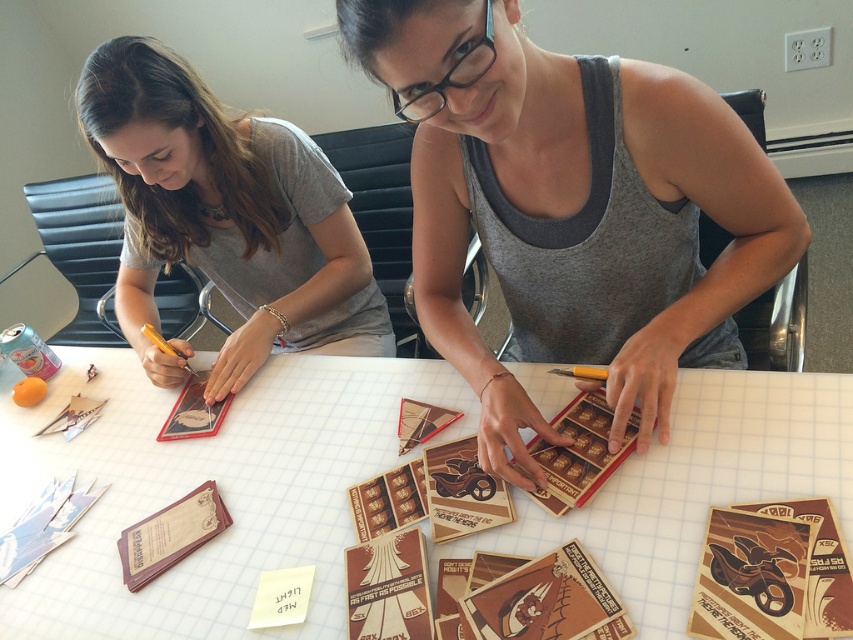
Question: Considering the real-world distances, which object is closest to the matte gray shirt at upper left?

Choices:
 (A) gray tank top at center
 (B) white grid paper at center

Answer: (B)

Question: Which object is farther from the camera taking this photo?

Choices:
 (A) matte gray shirt at upper left
 (B) gray tank top at center
 (C) white grid paper at center

Answer: (A)

Question: Is gray tank top at center smaller than matte gray shirt at upper left?

Choices:
 (A) no
 (B) yes

Answer: (B)

Question: Does white grid paper at center come in front of gray tank top at center?

Choices:
 (A) yes
 (B) no

Answer: (B)

Question: Does white grid paper at center appear on the left side of matte gray shirt at upper left?

Choices:
 (A) yes
 (B) no

Answer: (B)

Question: Which point is closer to the camera?

Choices:
 (A) (500, 202)
 (B) (283, 333)

Answer: (A)